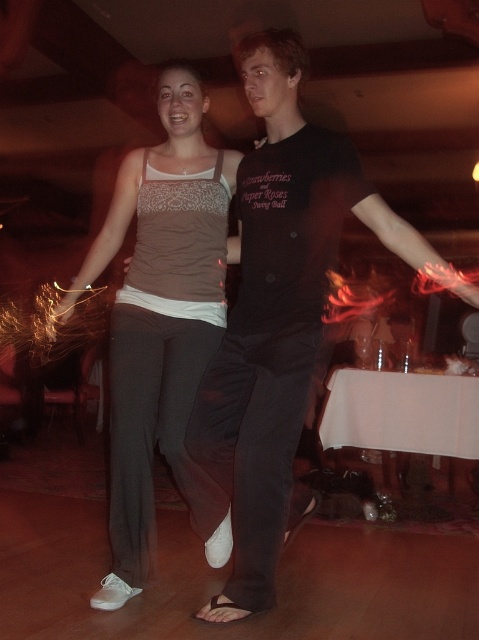
Which is below, black cotton shirt at center or matte gray tank top at center?

matte gray tank top at center is below.

Can you confirm if black cotton shirt at center is positioned above matte gray tank top at center?

Yes.

At what (x,y) coordinates should I click in order to perform the action: click on black cotton shirt at center. Please return your answer as a coordinate pair (x, y). Looking at the image, I should click on (281, 314).